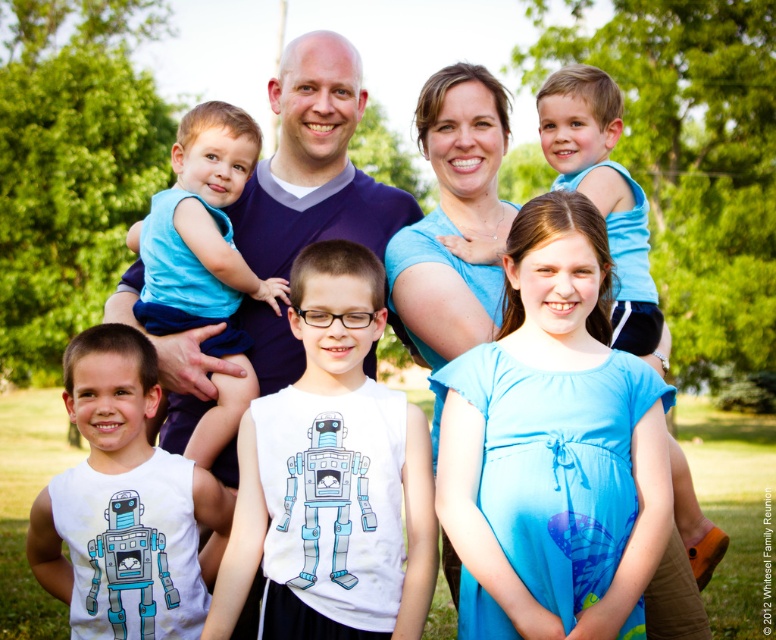
You are a photographer reviewing the image of the family. You notice two shirts in the scene, the blue sleeveless shirt at upper left and the light blue fabric shirt at upper right. Which shirt appears smaller in size?

The blue sleeveless shirt at upper left appears smaller in size compared to the light blue fabric shirt at upper right.

You are standing in the park and see the family photo described. Where is the white matte tank top at center positioned relative to the other elements in the scene?

The white matte tank top at center is located at point (331, 476) in the scene coordinates.

You are a photographer setting up for a family portrait. You notice two shirts in the scene, the blue sleeveless shirt at upper left and the light blue fabric shirt at upper right. Which shirt should you adjust in your composition to ensure both shirts are equally visible, considering their sizes?

The blue sleeveless shirt at upper left has a lesser width compared to the light blue fabric shirt at upper right. To ensure both shirts are equally visible, you should adjust the position of the light blue fabric shirt at upper right to make it smaller or move it closer to the blue sleeveless shirt at upper left.